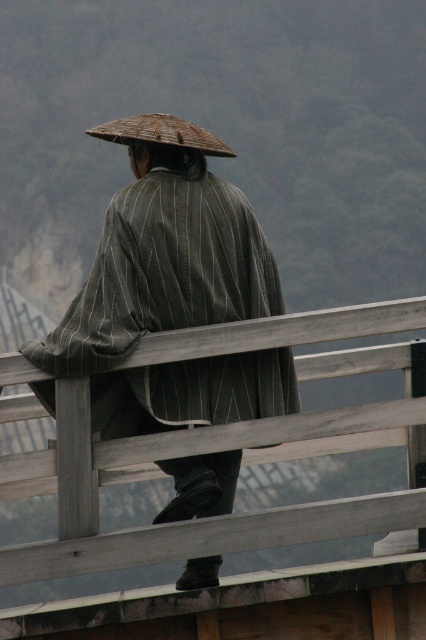
Is striped fabric kimono at center bigger than brown woven straw hat at upper center?

Incorrect, striped fabric kimono at center is not larger than brown woven straw hat at upper center.

Between point (112, 134) and point (143, 129), which one is positioned in front?

Point (143, 129) is more forward.

Does point (155, 141) come behind point (198, 148)?

No, it is in front of (198, 148).

I want to click on striped fabric kimono at center, so click(172, 291).